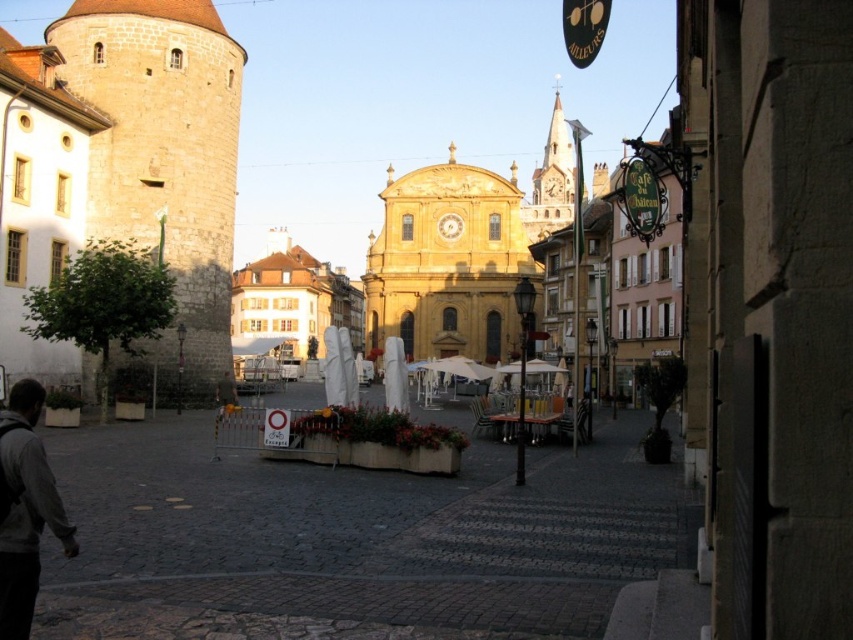
Which is more to the right, golden stone church at center or dark gray jacket at lower left?

Positioned to the right is golden stone church at center.

Is golden stone church at center bigger than dark gray jacket at lower left?

Yes.

Find the location of a particular element. The width and height of the screenshot is (853, 640). golden stone church at center is located at coordinates (447, 262).

The image size is (853, 640). I want to click on golden stone church at center, so click(x=447, y=262).

Between brown stone tower at left and dark gray jacket at lower left, which one is positioned higher?

brown stone tower at left is above.

Does brown stone tower at left have a greater width compared to dark gray jacket at lower left?

Yes.

The image size is (853, 640). I want to click on brown stone tower at left, so click(164, 161).

This screenshot has height=640, width=853. Find the location of `brown stone tower at left`. brown stone tower at left is located at coordinates (164, 161).

Is smooth stone alley at center positioned in front of golden stone church at center?

Yes, it is.

Does smooth stone alley at center appear on the left side of golden stone church at center?

Correct, you'll find smooth stone alley at center to the left of golden stone church at center.

Does point (509, 449) lie behind point (498, 317)?

No.

You are a GUI agent. You are given a task and a screenshot of the screen. Output one action in this format:
    pyautogui.click(x=<x>, y=<y>)
    Task: Click on the smooth stone alley at center
    This screenshot has height=640, width=853.
    Given the screenshot: What is the action you would take?
    pyautogui.click(x=351, y=540)